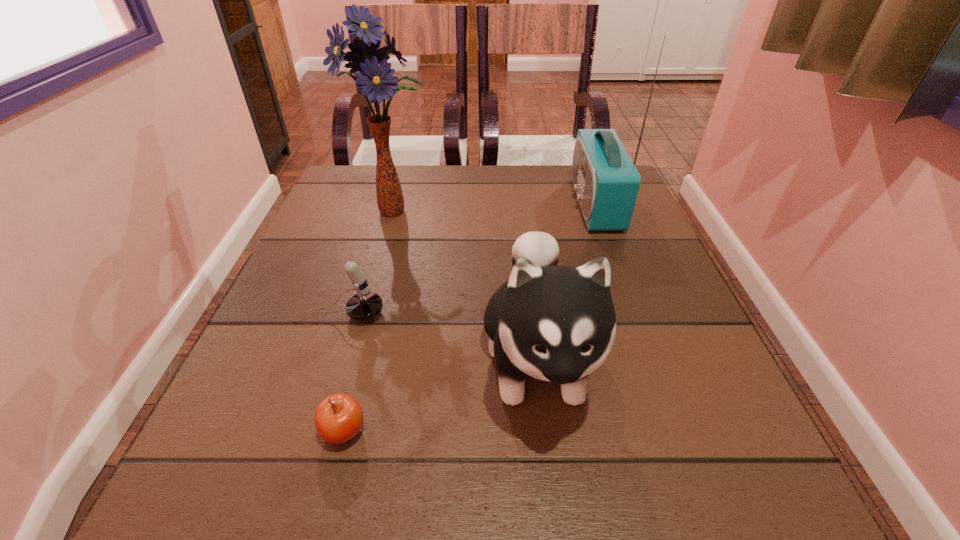
Image resolution: width=960 pixels, height=540 pixels. I want to click on free space between the fourth tallest object and the flower arrangement, so click(368, 262).

Where is `object that stands as the fourth closest to the third tallest object`? This screenshot has height=540, width=960. object that stands as the fourth closest to the third tallest object is located at coordinates (374, 76).

You are a GUI agent. You are given a task and a screenshot of the screen. Output one action in this format:
    pyautogui.click(x=<x>, y=<y>)
    Task: Click on the object identified as the third closest to the microphone
    This screenshot has height=540, width=960.
    Given the screenshot: What is the action you would take?
    pyautogui.click(x=374, y=76)

Locate an element on the screen. This screenshot has width=960, height=540. vacant area that satisfies the following two spatial constraints: 1. on the front panel of the radio receiver; 2. at the face of the puppy is located at coordinates (653, 359).